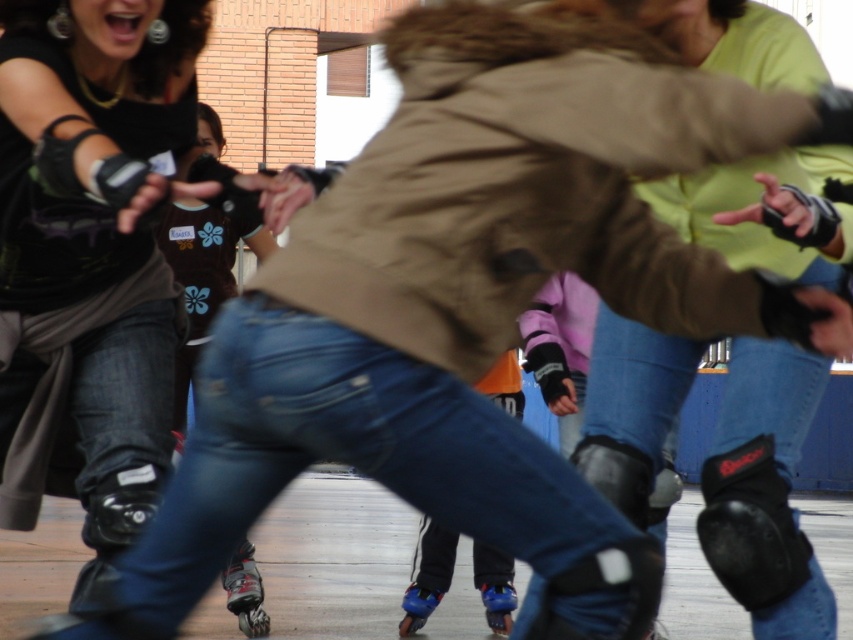
You are a photographer trying to capture the blue plastic roller skate at lower center and the blue matte roller skate at lower center in a clear photo. Since both are in motion, you need to focus on the part of the image where they are closest. Which skate should you aim your camera at to ensure it stays in focus longer?

The blue matte roller skate at lower center is on the left side, so it might be easier to focus on it first as it is closer to the photographer. However, the blue plastic roller skate at lower center is on the right side of the blue matte roller skate at lower center, so focusing on the right skate might keep it in frame longer as motion continues. Wait, the description says the blue plastic is to the right of the blue matte. Since both are moving, perhaps the one further right is moving away, so the left?

You are a photographer trying to capture the shiny black roller skate at lower center in your shot. The camera is positioned at the center of the image. Based on the scene description, will the skate be in the lower half of the photo?

The shiny black roller skate at lower center is located at point (x=245, y=592). Since the y coordinate 0.288 is below 0.5, the skate is in the lower half of the photo.